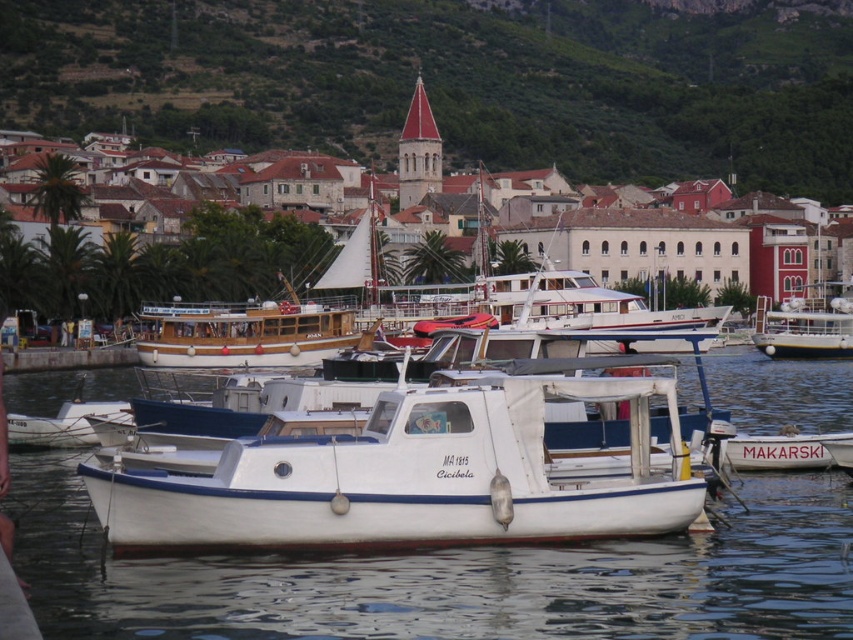
Question: Does green grassy hillside at upper center come behind white matte boat at right?

Choices:
 (A) no
 (B) yes

Answer: (B)

Question: Which of the following is the closest to the observer?

Choices:
 (A) pyautogui.click(x=776, y=547)
 (B) pyautogui.click(x=844, y=349)

Answer: (A)

Question: Which point is farther from the camera taking this photo?

Choices:
 (A) (193, 259)
 (B) (724, 611)
 (C) (660, 108)

Answer: (C)

Question: In this image, where is white glossy water at center located relative to white matte boat at center?

Choices:
 (A) above
 (B) below

Answer: (B)

Question: Among these objects, which one is nearest to the camera?

Choices:
 (A) white stone buildings at center
 (B) green grassy hillside at upper center
 (C) white matte boat at right
 (D) white glossy water at center

Answer: (D)

Question: Considering the relative positions of green grassy hillside at upper center and white matte boat at center in the image provided, where is green grassy hillside at upper center located with respect to white matte boat at center?

Choices:
 (A) left
 (B) right

Answer: (B)